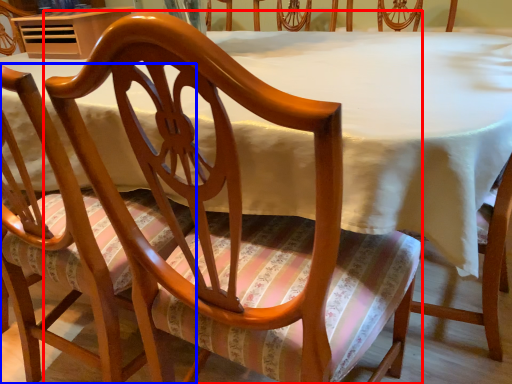
Question: Which point is closer to the camera, chair (highlighted by a red box) or chair (highlighted by a blue box)?

Choices:
 (A) chair
 (B) chair

Answer: (A)